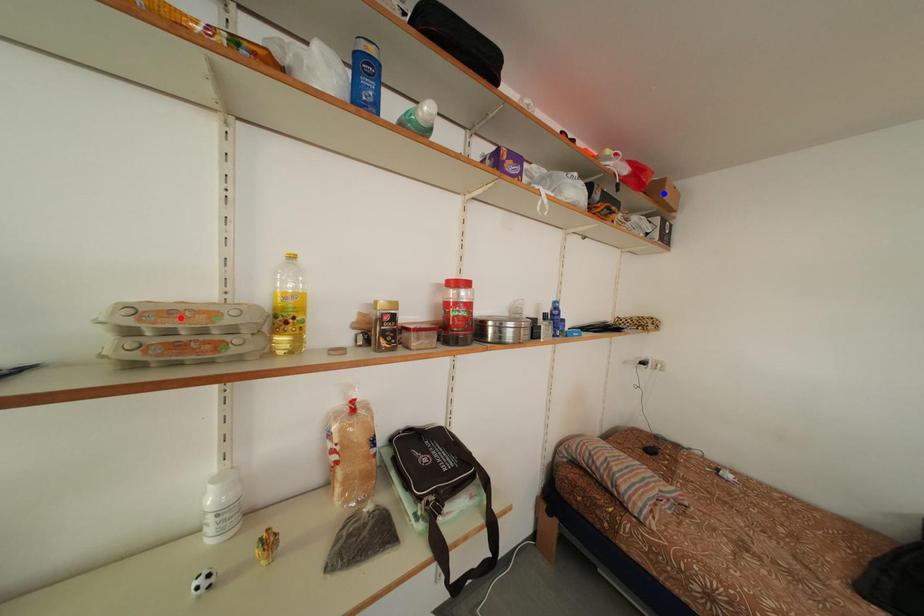
Question: In the image, two points are highlighted. Which point is nearer to the camera? Reply with the corresponding letter.

Choices:
 (A) blue point
 (B) red point

Answer: (B)